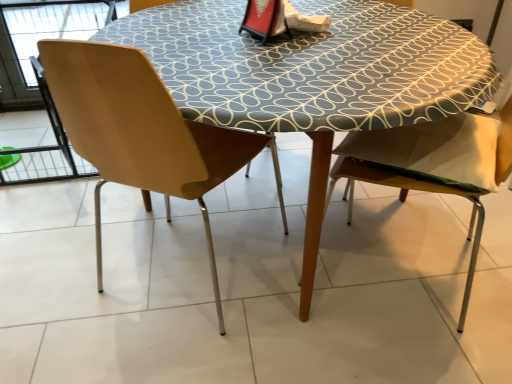
This screenshot has width=512, height=384. I want to click on vacant area that lies to the right of matte wood chair at left, arranged as the 1th chair when viewed from the left, so click(311, 291).